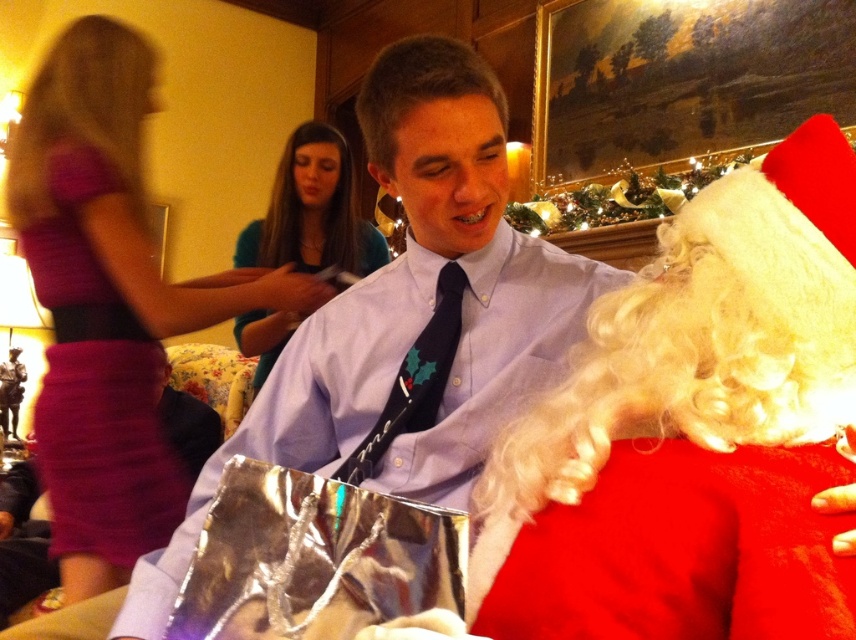
Question: Estimate the real-world distances between objects in this image. Which object is closer to the red fuzzy santa at right?

Choices:
 (A) shiny metallic bag at lower center
 (B) frosted glass bowl at upper center
 (C) matte pink skirt at left

Answer: (A)

Question: Is matte purple shirt at center positioned before purple satin dress at left?

Choices:
 (A) yes
 (B) no

Answer: (A)

Question: Which point is farther to the camera?

Choices:
 (A) purple satin dress at left
 (B) matte pink skirt at left
 (C) frosted glass bowl at upper center
 (D) shiny metallic bag at lower center

Answer: (C)

Question: Is purple satin dress at left closer to the viewer compared to black satin tie at center?

Choices:
 (A) yes
 (B) no

Answer: (B)

Question: Can you confirm if matte pink skirt at left is smaller than black satin tie at center?

Choices:
 (A) yes
 (B) no

Answer: (B)

Question: Among these objects, which one is nearest to the camera?

Choices:
 (A) red fuzzy santa at right
 (B) shiny metallic bag at lower center

Answer: (A)